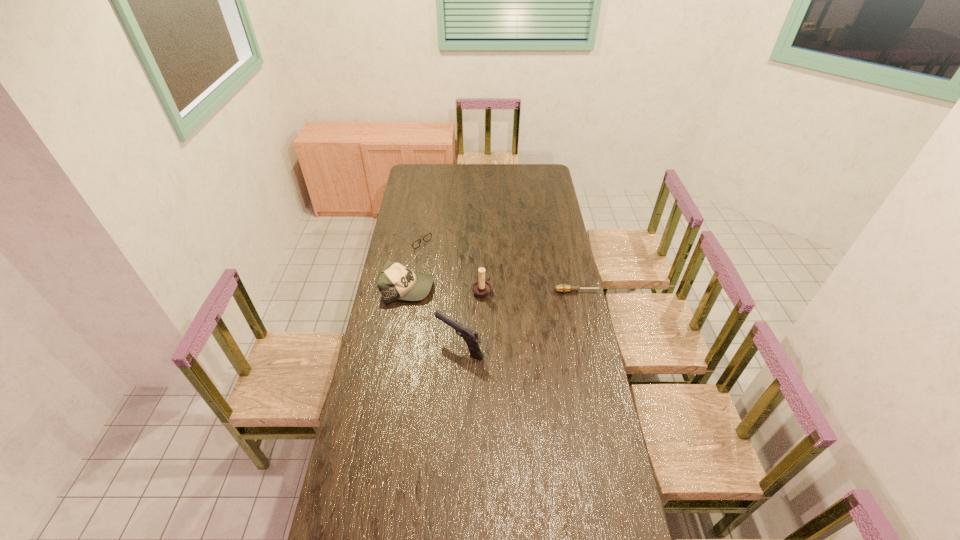
This screenshot has height=540, width=960. Find the location of `sunglasses at the left edge`. sunglasses at the left edge is located at coordinates (426, 238).

I want to click on object that is at the right edge, so click(x=562, y=288).

The width and height of the screenshot is (960, 540). Find the location of `free region at the far edge of the desktop`. free region at the far edge of the desktop is located at coordinates [516, 174].

Where is `free spot at the near edge of the desktop`? This screenshot has height=540, width=960. free spot at the near edge of the desktop is located at coordinates (447, 528).

Where is `blank space at the left edge of the desktop`? The image size is (960, 540). blank space at the left edge of the desktop is located at coordinates (430, 195).

You are a GUI agent. You are given a task and a screenshot of the screen. Output one action in this format:
    pyautogui.click(x=<x>, y=<y>)
    Task: Click on the vacant space at the right edge
    The image size is (960, 540).
    Given the screenshot: What is the action you would take?
    pyautogui.click(x=563, y=258)

Identify the location of free space at the far right corner of the desktop. (551, 174).

Identify the location of free space between the screwdriver and the nearest object. (518, 319).

You are a GUI agent. You are given a task and a screenshot of the screen. Output one action in this format:
    pyautogui.click(x=<x>, y=<y>)
    Task: Click on the free space between the sunglasses and the baseball cap
    The width and height of the screenshot is (960, 540).
    Given the screenshot: What is the action you would take?
    pyautogui.click(x=411, y=263)

You are a GUI agent. You are given a task and a screenshot of the screen. Output one action in this format:
    pyautogui.click(x=<x>, y=<y>)
    Task: Click on the blank region between the baseball cap and the second shortest object
    
    Given the screenshot: What is the action you would take?
    pyautogui.click(x=411, y=263)